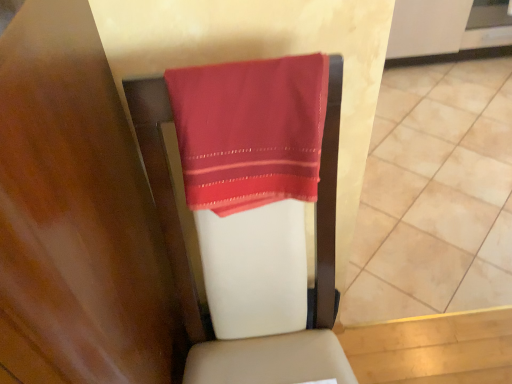
Describe the element at coordinates (435, 195) in the screenshot. This screenshot has height=384, width=512. I see `matte red towel at center` at that location.

Identify the location of matte red towel at center. (435, 195).

Locate an element on the screen. Image resolution: width=512 pixels, height=384 pixels. satin red towel at center is located at coordinates (250, 131).

What do you see at coordinates (250, 131) in the screenshot?
I see `satin red towel at center` at bounding box center [250, 131].

Identify the location of matte red towel at center. Image resolution: width=512 pixels, height=384 pixels. pyautogui.click(x=435, y=195).

In the image, is satin red towel at center on the left side or the right side of matte red towel at center?

satin red towel at center is to the left of matte red towel at center.

Is satin red towel at center further to camera compared to matte red towel at center?

No, it is not.

Considering the positions of point (210, 74) and point (503, 150), is point (210, 74) closer or farther from the camera than point (503, 150)?

Point (210, 74).

From the image's perspective, would you say satin red towel at center is shown under matte red towel at center?

Yes, from the image's perspective, satin red towel at center is beneath matte red towel at center.

From a real-world perspective, which object stands above the other?

satin red towel at center.

Considering the sizes of objects satin red towel at center and matte red towel at center in the image provided, who is thinner, satin red towel at center or matte red towel at center?

satin red towel at center is thinner.

Can you confirm if satin red towel at center is shorter than matte red towel at center?

No, satin red towel at center is not shorter than matte red towel at center.

Considering the sizes of objects satin red towel at center and matte red towel at center in the image provided, who is smaller, satin red towel at center or matte red towel at center?

satin red towel at center.

Do you think satin red towel at center is within matte red towel at center, or outside of it?

satin red towel at center is spatially situated outside matte red towel at center.

Are satin red towel at center and matte red towel at center making contact?

No, satin red towel at center is not with matte red towel at center.

Is satin red towel at center facing away from matte red towel at center?

No, satin red towel at center is not facing away from matte red towel at center.

Can you tell me how much satin red towel at center and matte red towel at center differ in facing direction?

satin red towel at center and matte red towel at center are facing 88.9 degrees away from each other.

Measure the distance from satin red towel at center to matte red towel at center.

satin red towel at center is 1.23 meters from matte red towel at center.

At what (x,y) coordinates should I click in order to perform the action: click on tile lying above the satin red towel at center (from the image's perspective). Please return your answer as a coordinate pair (x, y). Image resolution: width=512 pixels, height=384 pixels. Looking at the image, I should click on (435, 195).

Considering the relative positions of matte red towel at center and satin red towel at center in the image provided, is matte red towel at center to the right of satin red towel at center from the viewer's perspective?

Correct, you'll find matte red towel at center to the right of satin red towel at center.

Relative to satin red towel at center, is matte red towel at center in front or behind?

matte red towel at center is behind satin red towel at center.

Which is more distant, (x=461, y=248) or (x=247, y=109)?

The point (x=461, y=248) is farther.

From the image's perspective, relative to satin red towel at center, is matte red towel at center above or below?

matte red towel at center is situated higher than satin red towel at center in the image.

From a real-world perspective, is matte red towel at center under satin red towel at center?

Yes, from a real-world perspective, matte red towel at center is beneath satin red towel at center.

From the picture: Does matte red towel at center have a greater width compared to satin red towel at center?

Correct, the width of matte red towel at center exceeds that of satin red towel at center.

Looking at this image, considering the relative sizes of matte red towel at center and satin red towel at center in the image provided, is matte red towel at center shorter than satin red towel at center?

Correct, matte red towel at center is not as tall as satin red towel at center.

Is matte red towel at center bigger than satin red towel at center?

Yes, matte red towel at center is bigger than satin red towel at center.

Looking at this image, is matte red towel at center situated inside satin red towel at center or outside?

matte red towel at center cannot be found inside satin red towel at center.

Is there a large distance between matte red towel at center and satin red towel at center?

matte red towel at center is far away from satin red towel at center.

Could you tell me if matte red towel at center is facing satin red towel at center?

No, matte red towel at center is not facing towards satin red towel at center.

Where is `tile that is under the satin red towel at center (from a real-world perspective)`? The image size is (512, 384). tile that is under the satin red towel at center (from a real-world perspective) is located at coordinates (435, 195).

You are a GUI agent. You are given a task and a screenshot of the screen. Output one action in this format:
    pyautogui.click(x=<x>, y=<y>)
    Task: Click on the towel below the matte red towel at center (from the image's perspective)
    This screenshot has height=384, width=512.
    Given the screenshot: What is the action you would take?
    pyautogui.click(x=250, y=131)

Image resolution: width=512 pixels, height=384 pixels. In order to click on tile located underneath the satin red towel at center (from a real-world perspective) in this screenshot , I will do `click(435, 195)`.